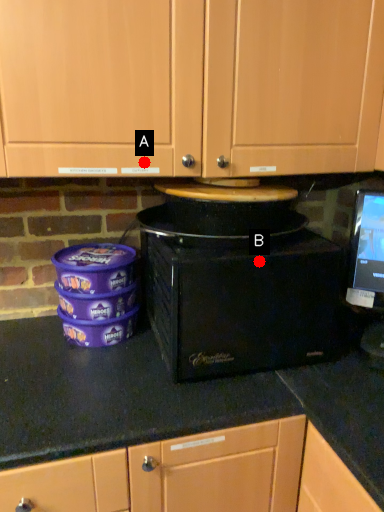
Question: Two points are circled on the image, labeled by A and B beside each circle. Which of the following is the closest to the observer?

Choices:
 (A) A is closer
 (B) B is closer

Answer: (B)